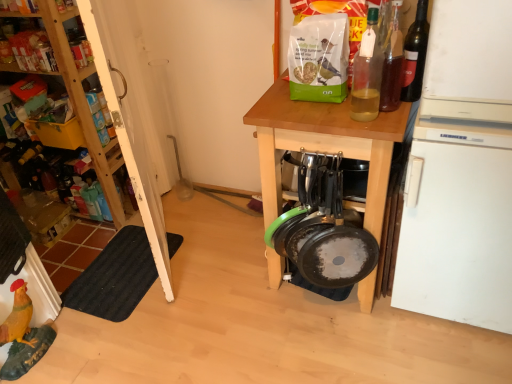
Question: Should I look upward or downward to see black rubber mat at lower left?

Choices:
 (A) down
 (B) up

Answer: (A)

Question: From a real-world perspective, is dark glass bottle at upper right, the 1th bottle in the right-to-left sequence, on wooden table at center?

Choices:
 (A) yes
 (B) no

Answer: (A)

Question: Is dark glass bottle at upper right, which ranks as the 3th bottle in left-to-right order, positioned before wooden table at center?

Choices:
 (A) no
 (B) yes

Answer: (B)

Question: Is there a large distance between dark glass bottle at upper right, the 1th bottle in the right-to-left sequence, and wooden table at center?

Choices:
 (A) yes
 (B) no

Answer: (B)

Question: Is dark glass bottle at upper right, which ranks as the 3th bottle in left-to-right order, thinner than wooden table at center?

Choices:
 (A) yes
 (B) no

Answer: (A)

Question: Is dark glass bottle at upper right, which ranks as the 3th bottle in left-to-right order, at the right side of wooden table at center?

Choices:
 (A) no
 (B) yes

Answer: (B)

Question: Does dark glass bottle at upper right, the 1th bottle in the right-to-left sequence, have a greater width compared to wooden table at center?

Choices:
 (A) yes
 (B) no

Answer: (B)

Question: From the image's perspective, does translucent glass bottle at upper right, which is the second bottle in left-to-right order, appear lower than white matte refrigerator at right?

Choices:
 (A) yes
 (B) no

Answer: (B)

Question: From a real-world perspective, is translucent glass bottle at upper right, marked as the second bottle in a right-to-left arrangement, beneath white matte refrigerator at right?

Choices:
 (A) yes
 (B) no

Answer: (B)

Question: Is translucent glass bottle at upper right, marked as the second bottle in a right-to-left arrangement, not close to white matte refrigerator at right?

Choices:
 (A) yes
 (B) no

Answer: (B)

Question: Can you confirm if translucent glass bottle at upper right, which is the second bottle in left-to-right order, is smaller than white matte refrigerator at right?

Choices:
 (A) yes
 (B) no

Answer: (A)

Question: Is translucent glass bottle at upper right, marked as the second bottle in a right-to-left arrangement, at the left side of white matte refrigerator at right?

Choices:
 (A) yes
 (B) no

Answer: (A)

Question: Can you confirm if translucent glass bottle at upper right, marked as the second bottle in a right-to-left arrangement, is wider than white matte refrigerator at right?

Choices:
 (A) yes
 (B) no

Answer: (B)

Question: Is wooden table at center not near wooden shelves at upper left?

Choices:
 (A) no
 (B) yes

Answer: (B)